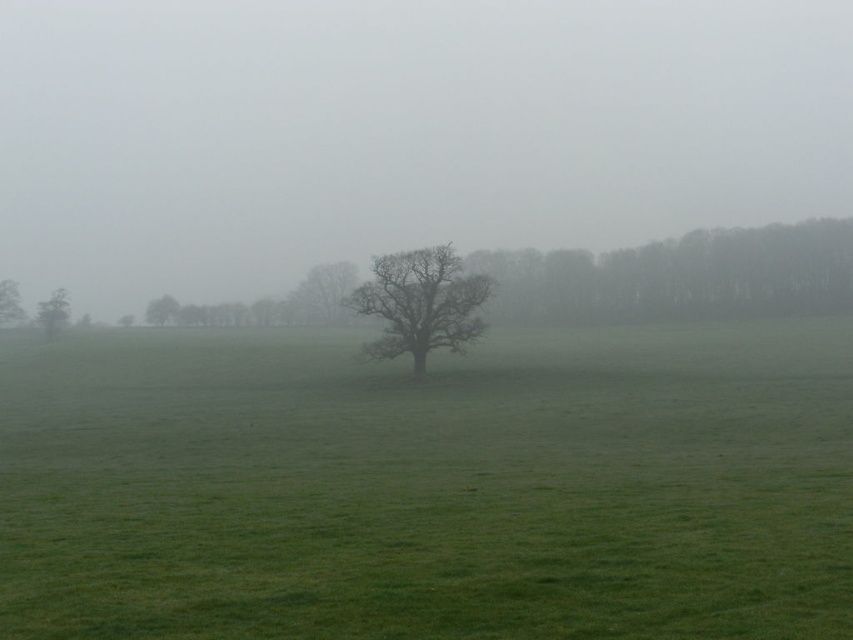
This screenshot has height=640, width=853. Describe the element at coordinates (430, 486) in the screenshot. I see `green grass pasture at center` at that location.

Who is higher up, green grass pasture at center or smooth gray tree at center?

smooth gray tree at center is above.

Which is in front, point (199, 492) or point (173, 320)?

Positioned in front is point (199, 492).

This screenshot has width=853, height=640. What are the coordinates of `green grass pasture at center` in the screenshot? It's located at (430, 486).

Who is positioned more to the right, bare branches at center or smooth brown tree at left?

bare branches at center is more to the right.

Does bare branches at center come behind smooth brown tree at left?

No.

The image size is (853, 640). Identify the location of bare branches at center. (322, 294).

Is point (592, 128) positioned behind point (169, 308)?

Yes, point (592, 128) is behind point (169, 308).

Is foggy translucent tree at center above smooth gray tree at center?

Yes.

Does point (4, 88) lie in front of point (161, 304)?

That is False.

Locate an element on the screen. Image resolution: width=853 pixels, height=640 pixels. foggy translucent tree at center is located at coordinates (399, 132).